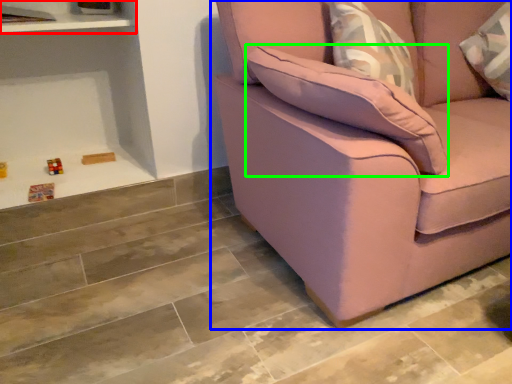
Question: Considering the real-world distances, which object is closest to shelf (highlighted by a red box)? studio couch (highlighted by a blue box) or pillow (highlighted by a green box).

Choices:
 (A) studio couch
 (B) pillow

Answer: (B)